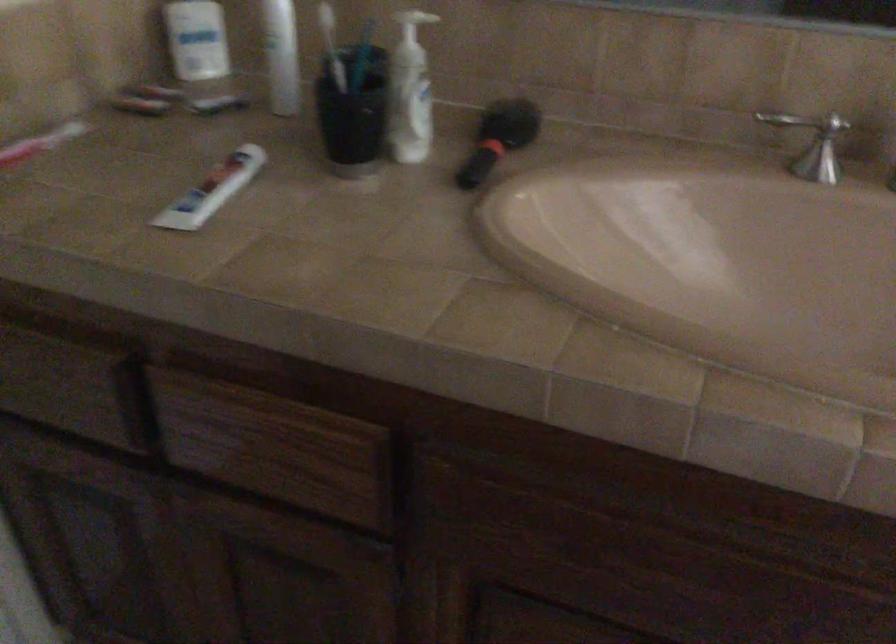
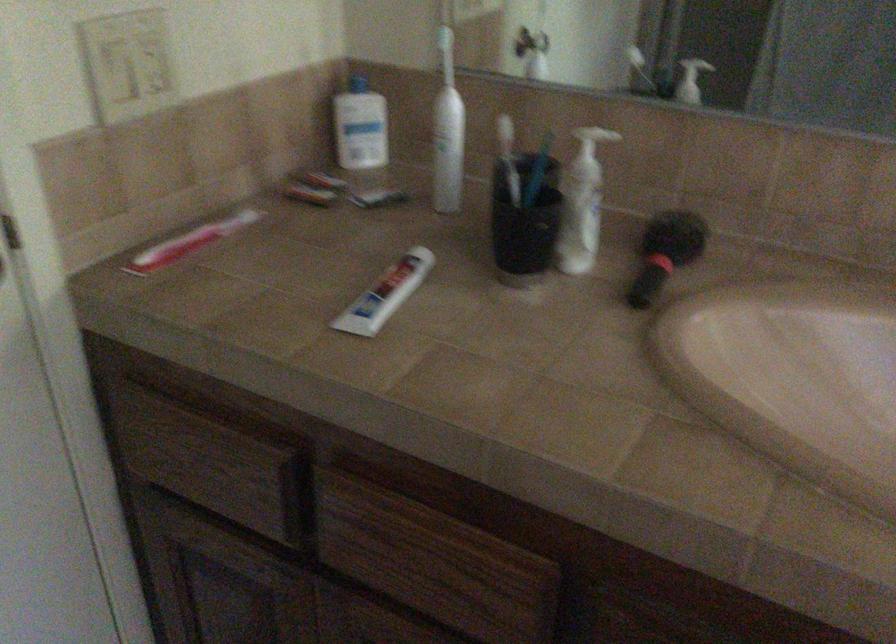
The point at (x=346, y=109) is marked in the first image. Where is the corresponding point in the second image?

(524, 222)